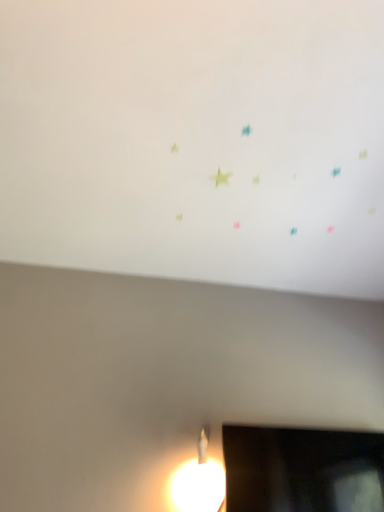
Question: Should I look upward or downward to see white matte wall at upper center?

Choices:
 (A) up
 (B) down

Answer: (A)

Question: From the image's perspective, does black glossy television at lower right appear higher than white matte wall at upper center?

Choices:
 (A) yes
 (B) no

Answer: (B)

Question: Is white matte wall at upper center surrounded by black glossy television at lower right?

Choices:
 (A) yes
 (B) no

Answer: (B)

Question: Considering the relative positions of black glossy television at lower right and white matte wall at upper center in the image provided, is black glossy television at lower right to the right of white matte wall at upper center from the viewer's perspective?

Choices:
 (A) no
 (B) yes

Answer: (B)

Question: Can you confirm if black glossy television at lower right is shorter than white matte wall at upper center?

Choices:
 (A) yes
 (B) no

Answer: (B)

Question: From a real-world perspective, does black glossy television at lower right stand above white matte wall at upper center?

Choices:
 (A) no
 (B) yes

Answer: (A)

Question: Does black glossy television at lower right appear on the left side of white matte wall at upper center?

Choices:
 (A) no
 (B) yes

Answer: (A)

Question: Is white matte wall at upper center turned away from black glossy television at lower right?

Choices:
 (A) no
 (B) yes

Answer: (A)

Question: Does white matte wall at upper center have a smaller size compared to black glossy television at lower right?

Choices:
 (A) yes
 (B) no

Answer: (B)

Question: From the image's perspective, is white matte wall at upper center on top of black glossy television at lower right?

Choices:
 (A) no
 (B) yes

Answer: (B)

Question: Is the position of white matte wall at upper center more distant than that of black glossy television at lower right?

Choices:
 (A) yes
 (B) no

Answer: (B)

Question: Is white matte wall at upper center not inside black glossy television at lower right?

Choices:
 (A) no
 (B) yes

Answer: (B)

Question: Considering the relative sizes of white matte wall at upper center and black glossy television at lower right in the image provided, is white matte wall at upper center bigger than black glossy television at lower right?

Choices:
 (A) yes
 (B) no

Answer: (A)

Question: Considering the relative positions of white matte wall at upper center and black glossy television at lower right in the image provided, is white matte wall at upper center to the left or to the right of black glossy television at lower right?

Choices:
 (A) left
 (B) right

Answer: (A)